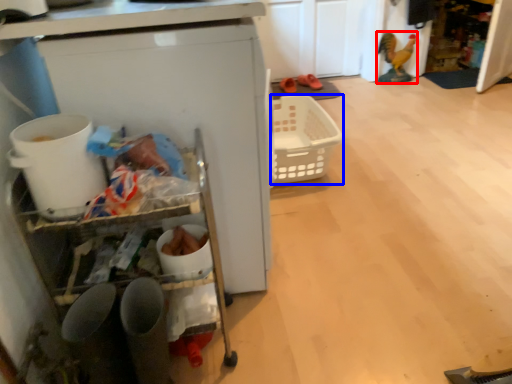
Question: Which object appears closest to the camera in this image, toy (highlighted by a red box) or basket (highlighted by a blue box)?

Choices:
 (A) toy
 (B) basket

Answer: (B)